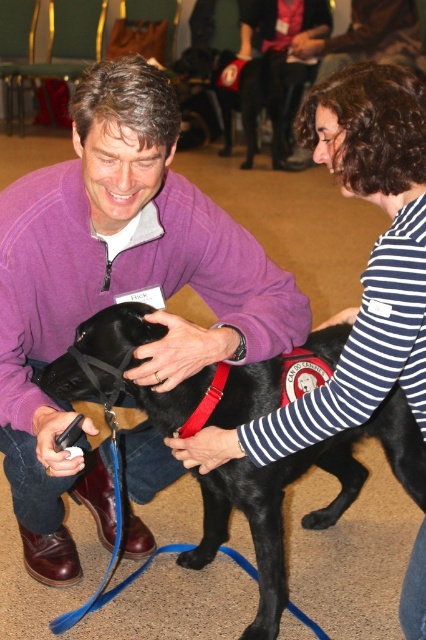
Which of these two, purple fleece sweater at center or shiny black dog at center, stands taller?

purple fleece sweater at center is taller.

This screenshot has width=426, height=640. I want to click on purple fleece sweater at center, so click(x=115, y=289).

Does striped cotton shirt at center have a lesser height compared to shiny black dog at center?

No, striped cotton shirt at center is not shorter than shiny black dog at center.

Which is in front, point (325, 404) or point (140, 400)?

Point (325, 404)

Identify the location of striped cotton shirt at center. The height and width of the screenshot is (640, 426). (363, 269).

Can you confirm if purple fleece sweater at center is positioned above striped cotton shirt at center?

Actually, purple fleece sweater at center is below striped cotton shirt at center.

Is purple fleece sweater at center closer to camera compared to striped cotton shirt at center?

No, it is behind striped cotton shirt at center.

Identify the location of purple fleece sweater at center. This screenshot has width=426, height=640. (115, 289).